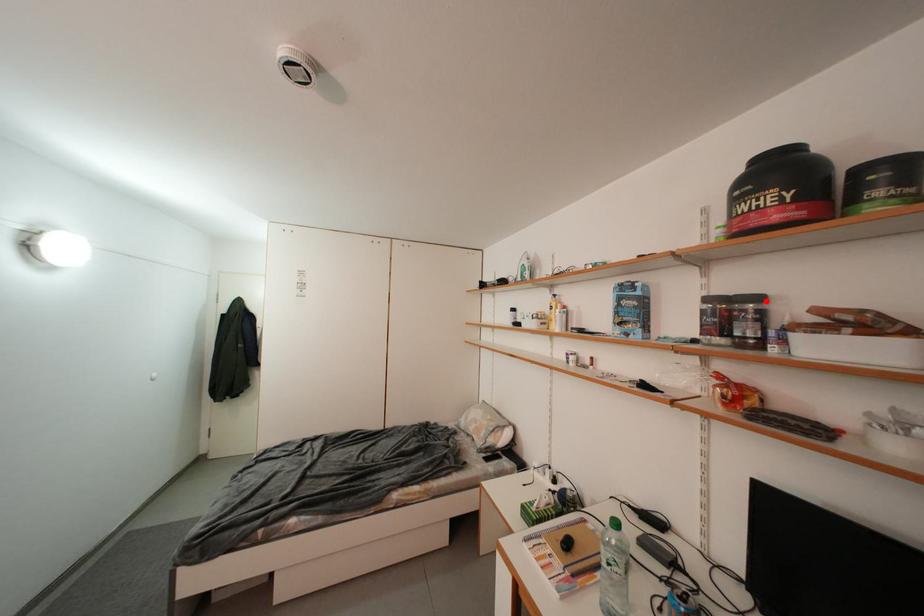
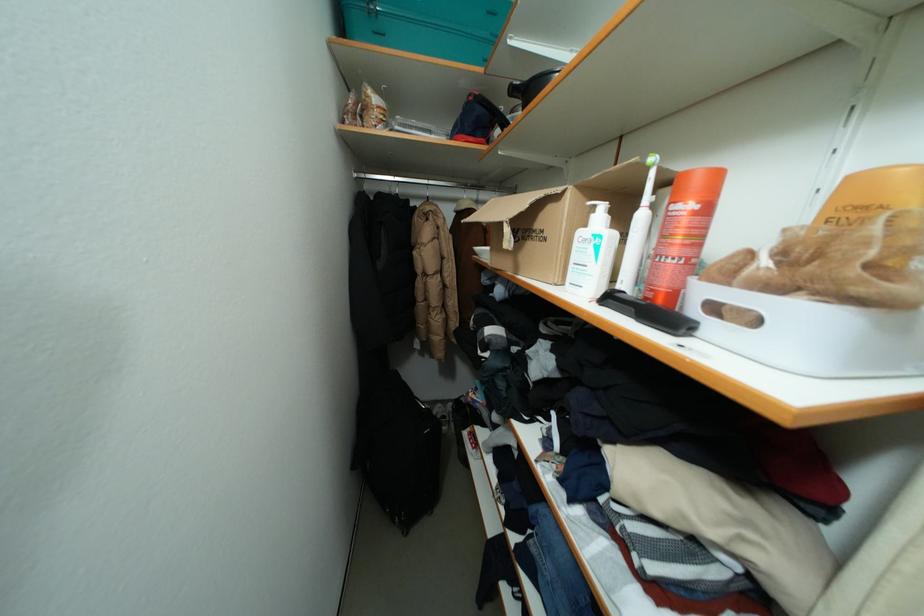
Question: I am providing you with two images of the same scene from different viewpoints. A red point is marked on the first image. Can you still see the location of the red point in image 2?

Choices:
 (A) Yes
 (B) No

Answer: (B)